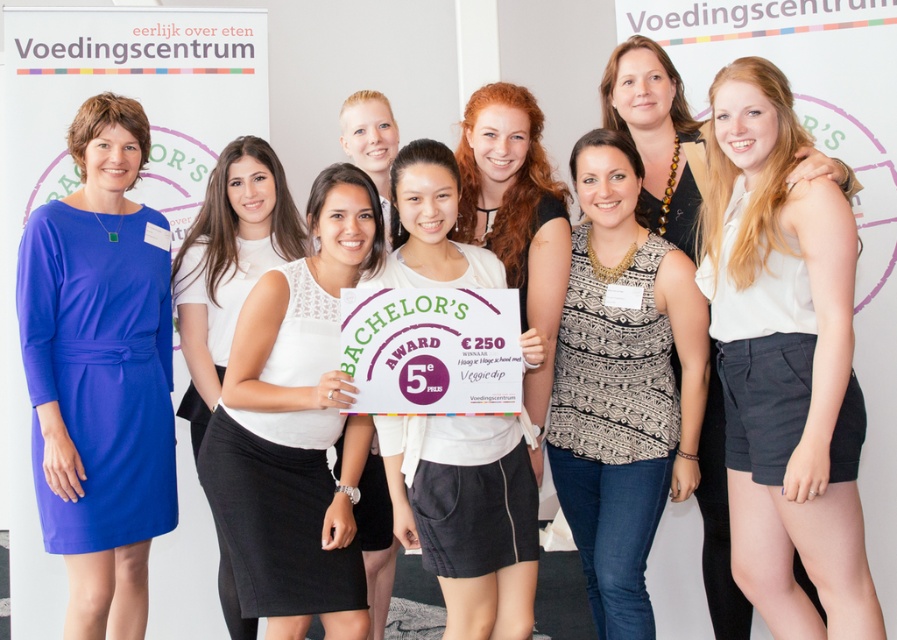
You are standing in front of the group photo and want to determine the relative positions of two points marked in the image. Which point is closer to you, point (111, 618) or point (547, 397)?

Point (111, 618) is closer to you than point (547, 397) because it is further to the viewer in the image.

You are a photographer at the event and need to ensure that the black printed tank top at center and the blonde hair at center are both visible in the frame. Based on their widths, which one is wider and might require more space in the composition?

The black printed tank top at center is wider than the blonde hair at center, so it requires more space in the composition.